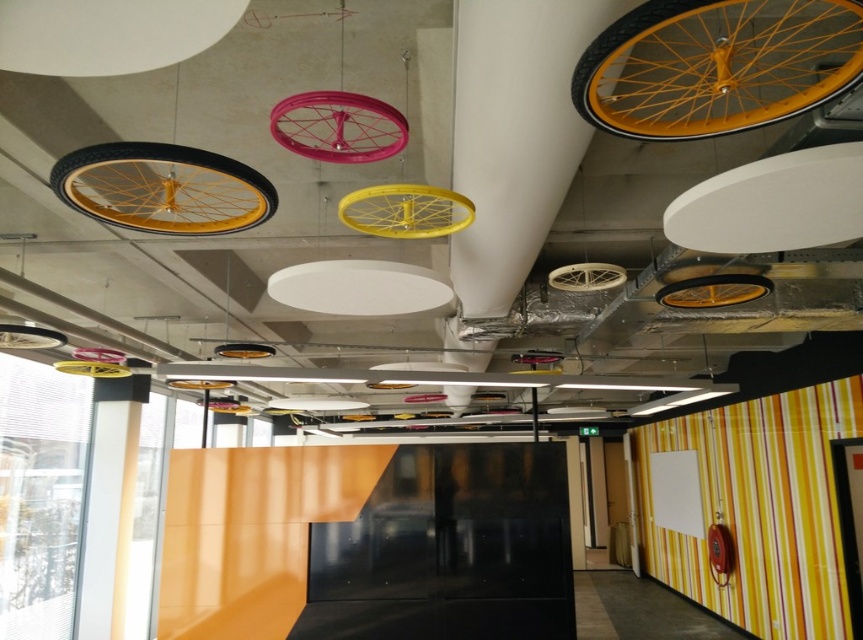
Question: Considering the real-world distances, which object is farthest from the yellow matte bicycle wheel at upper right?

Choices:
 (A) yellow matte tire at center
 (B) matte yellow rimmed bicycle wheel at center

Answer: (A)

Question: Which of these objects is positioned closest to the yellow matte bicycle wheel at center?

Choices:
 (A) yellow matte bicycle wheel at upper right
 (B) matte yellow rimmed bicycle wheel at center

Answer: (B)

Question: Which of the following is the farthest from the observer?

Choices:
 (A) yellow matte bicycle wheel at center
 (B) matte yellow rimmed bicycle wheel at center
 (C) metallic gold wheel at center

Answer: (C)

Question: Is yellow matte bicycle wheel at upper right below white matte wheel at center?

Choices:
 (A) no
 (B) yes

Answer: (A)

Question: Does yellow matte bicycle wheel at upper right have a lesser width compared to yellow matte bicycle wheel at center?

Choices:
 (A) no
 (B) yes

Answer: (A)

Question: Is yellow matte wheel at center positioned at the back of yellow matte tire at center?

Choices:
 (A) yes
 (B) no

Answer: (B)